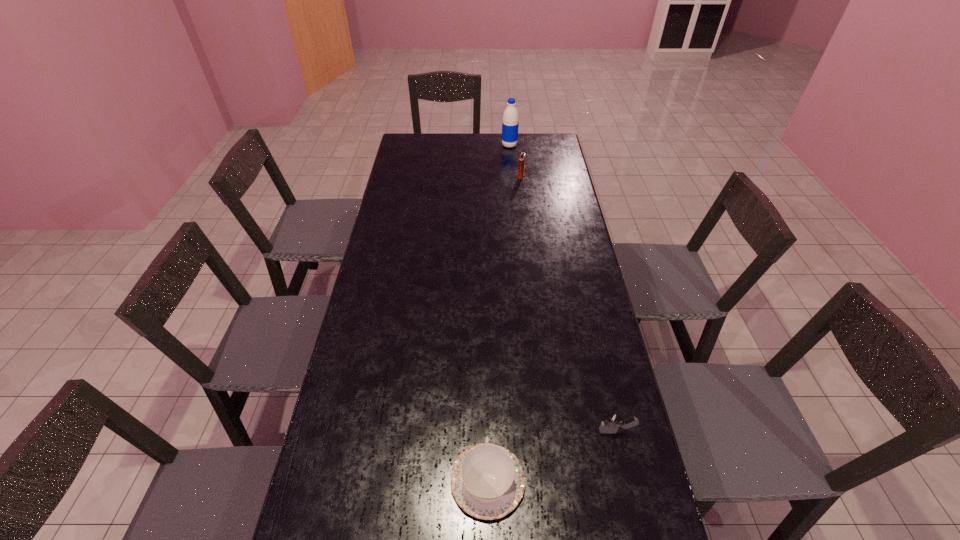
In the image, there is a desktop. Identify the location of free space at the far right corner. Image resolution: width=960 pixels, height=540 pixels. (535, 147).

Image resolution: width=960 pixels, height=540 pixels. Find the location of `vacant area that lies between the third shortest object and the leftmost object`. vacant area that lies between the third shortest object and the leftmost object is located at coordinates (504, 329).

In order to click on empty space between the farthest object and the shorter igniter in this screenshot , I will do `click(563, 288)`.

The height and width of the screenshot is (540, 960). I want to click on free area in between the water bottle and the third nearest object, so click(516, 161).

Find the location of a particular element. free space between the left igniter and the tallest object is located at coordinates (516, 161).

The height and width of the screenshot is (540, 960). I want to click on free space between the tallest object and the right igniter, so click(x=563, y=288).

At what (x,y) coordinates should I click in order to perform the action: click on vacant region between the nearest object and the tallest object. Please return your answer as a coordinate pair (x, y). The image size is (960, 540). Looking at the image, I should click on [x=498, y=313].

The height and width of the screenshot is (540, 960). What are the coordinates of `blank region between the shorter igniter and the water bottle` in the screenshot? It's located at (563, 288).

Where is `vacant area that lies between the left igniter and the leftmost object`? The height and width of the screenshot is (540, 960). vacant area that lies between the left igniter and the leftmost object is located at coordinates (504, 329).

Identify the location of free space between the left igniter and the farthest object. This screenshot has height=540, width=960. (516, 161).